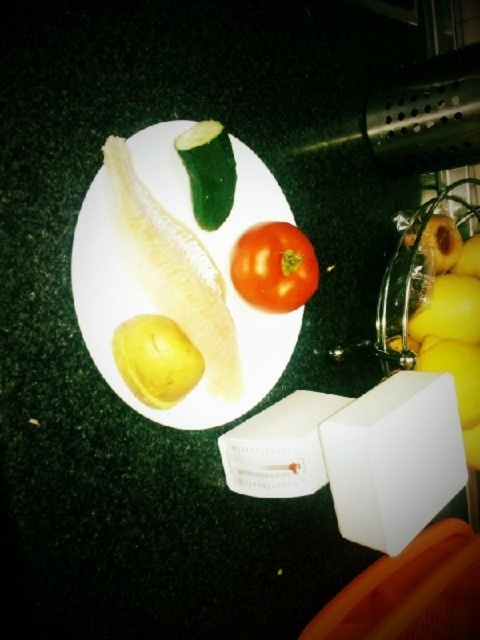
Is the position of red matte tomato at center less distant than that of yellow matte potato at center?

No, it is behind yellow matte potato at center.

Describe the element at coordinates (274, 268) in the screenshot. I see `red matte tomato at center` at that location.

Locate an element on the screen. The width and height of the screenshot is (480, 640). red matte tomato at center is located at coordinates (274, 268).

The image size is (480, 640). What are the coordinates of `red matte tomato at center` in the screenshot? It's located at (274, 268).

Is yellow matte bananas at right taller than yellow matte potato at center?

Indeed, yellow matte bananas at right has a greater height compared to yellow matte potato at center.

Which is in front, point (465, 288) or point (130, 356)?

Point (130, 356) is more forward.

Where is `yellow matte bananas at right`? yellow matte bananas at right is located at coordinates (446, 314).

Is yellow matte potato at center positioned in front of green smooth pickled at center?

That is True.

In the scene shown: Who is more distant from viewer, (149,348) or (212,141)?

Point (212,141)

Where is `yellow matte potato at center`? This screenshot has height=640, width=480. yellow matte potato at center is located at coordinates (156, 358).